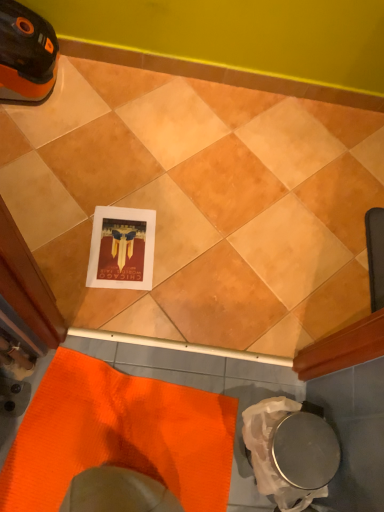
Find the location of a particular element. empty space that is ontop of orange textured bath towel at lower center is located at coordinates (121, 429).